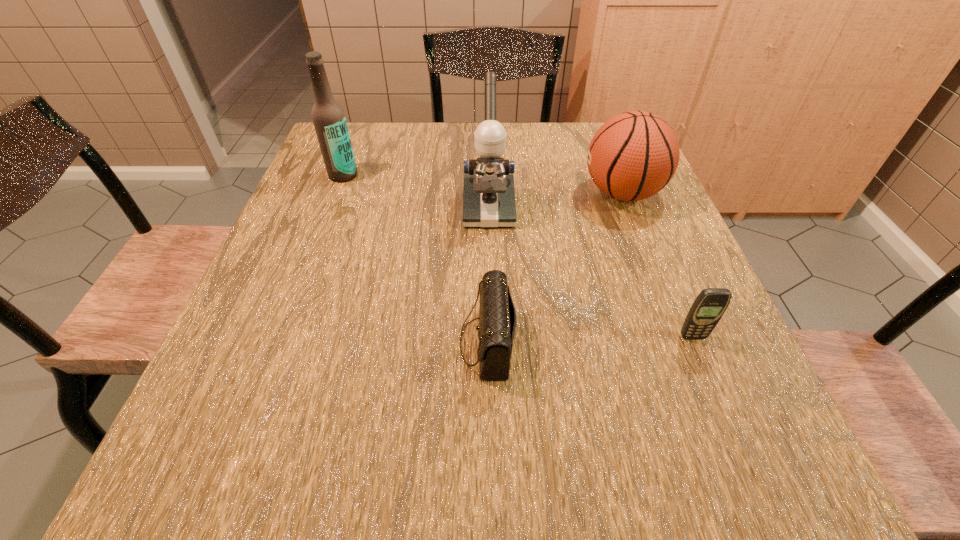
Find the location of `unoccupied position between the shortest object and the beer bottle`. unoccupied position between the shortest object and the beer bottle is located at coordinates (415, 259).

Locate an element on the screen. The image size is (960, 540). the third closest object to the clutch bag is located at coordinates (634, 155).

Select which object is the third closest to the clutch bag. Please provide its 2D coordinates. Your answer should be formatted as a tuple, i.e. [(x, y)], where the tuple contains the x and y coordinates of a point satisfying the conditions above.

[(634, 155)]

Locate an element on the screen. The height and width of the screenshot is (540, 960). vacant point that satisfies the following two spatial constraints: 1. on the side where the inflation valve is located; 2. at the eyepiece of the microscope is located at coordinates (628, 208).

Where is `free space that satisfies the following two spatial constraints: 1. at the eyepiece of the microscope; 2. on the front flap of the shortest object`? This screenshot has height=540, width=960. free space that satisfies the following two spatial constraints: 1. at the eyepiece of the microscope; 2. on the front flap of the shortest object is located at coordinates (492, 342).

The image size is (960, 540). I want to click on free region that satisfies the following two spatial constraints: 1. at the eyepiece of the microscope; 2. on the front flap of the shortest object, so click(492, 342).